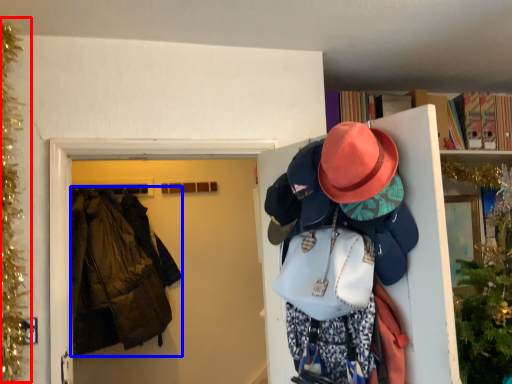
Question: Which object is closer to the camera taking this photo, christmas decoration (highlighted by a red box) or jacket (highlighted by a blue box)?

Choices:
 (A) christmas decoration
 (B) jacket

Answer: (A)